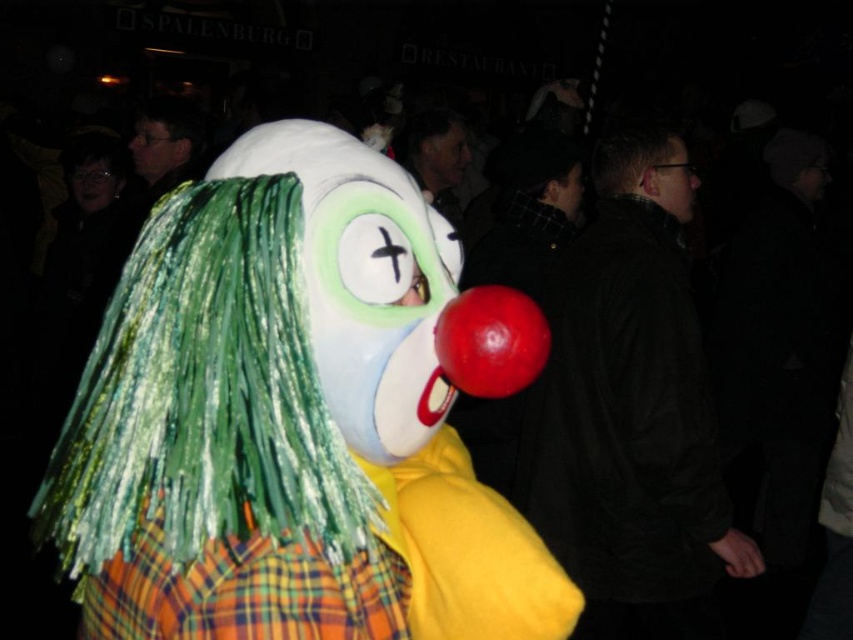
Does matte white clown nose at center have a lesser height compared to smooth black hair at center?

Correct, matte white clown nose at center is not as tall as smooth black hair at center.

Can you confirm if matte white clown nose at center is thinner than smooth black hair at center?

Correct, matte white clown nose at center's width is less than smooth black hair at center's.

Does point (426, 250) come closer to viewer compared to point (439, 150)?

Yes, it is in front of point (439, 150).

Locate an element on the screen. The width and height of the screenshot is (853, 640). matte white clown nose at center is located at coordinates (376, 316).

Is point (184, 154) closer to camera compared to point (144, 179)?

Yes, point (184, 154) is closer to viewer.

This screenshot has width=853, height=640. What do you see at coordinates (167, 144) in the screenshot?
I see `matte black jacket at upper left` at bounding box center [167, 144].

Find the location of a particular element. matte black jacket at upper left is located at coordinates point(167,144).

Consider the image. Does matte black jacket at upper left lie behind matte red clown nose at center?

No, it is not.

Describe the element at coordinates (167, 144) in the screenshot. The image size is (853, 640). I see `matte black jacket at upper left` at that location.

Measure the distance between point (157, 157) and camera.

Point (157, 157) and camera are 3.01 meters apart from each other.

This screenshot has width=853, height=640. I want to click on matte black jacket at upper left, so click(x=167, y=144).